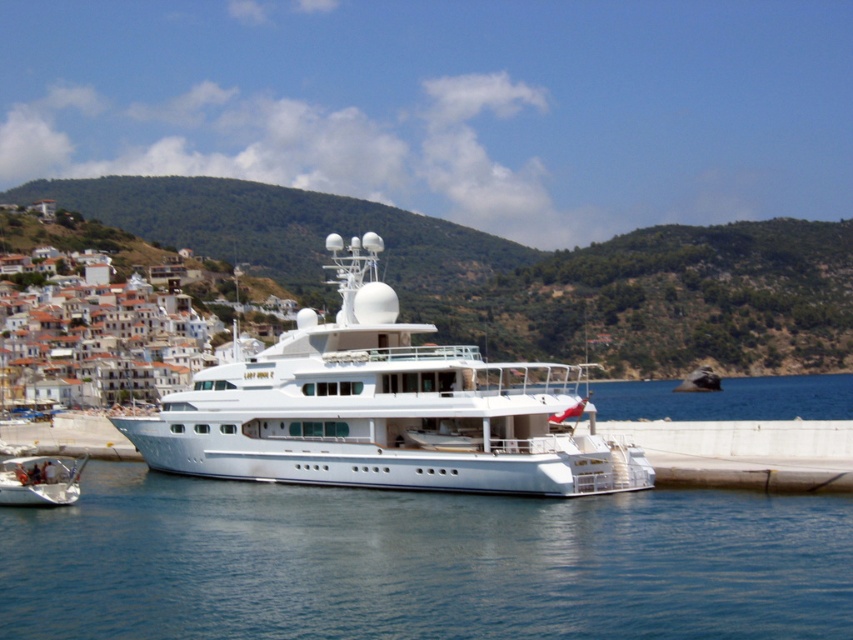
Question: Can you confirm if green leafy hillside at upper left is smaller than white glossy cruise ship at center?

Choices:
 (A) no
 (B) yes

Answer: (A)

Question: Which of the following is the farthest from the observer?

Choices:
 (A) green leafy hillside at upper left
 (B) white glossy dinghy at lower left
 (C) white glossy cruise ship at center
 (D) transparent blue water at lower center

Answer: (A)

Question: Is transparent blue water at lower center closer to the viewer compared to white glossy cruise ship at center?

Choices:
 (A) yes
 (B) no

Answer: (A)

Question: Does white glossy cruise ship at center have a lesser width compared to white glossy dinghy at lower left?

Choices:
 (A) yes
 (B) no

Answer: (B)

Question: Considering the real-world distances, which object is closest to the white glossy dinghy at lower left?

Choices:
 (A) white glossy cruise ship at center
 (B) transparent blue water at lower center

Answer: (A)

Question: Which of the following is the closest to the observer?

Choices:
 (A) (312, 524)
 (B) (340, 253)

Answer: (A)